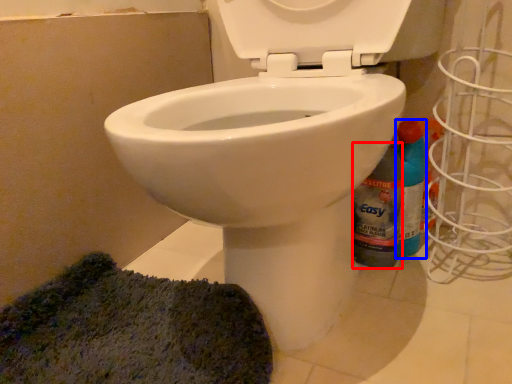
Question: Which object is closer to the camera taking this photo, bottle (highlighted by a red box) or cleaning product (highlighted by a blue box)?

Choices:
 (A) bottle
 (B) cleaning product

Answer: (A)